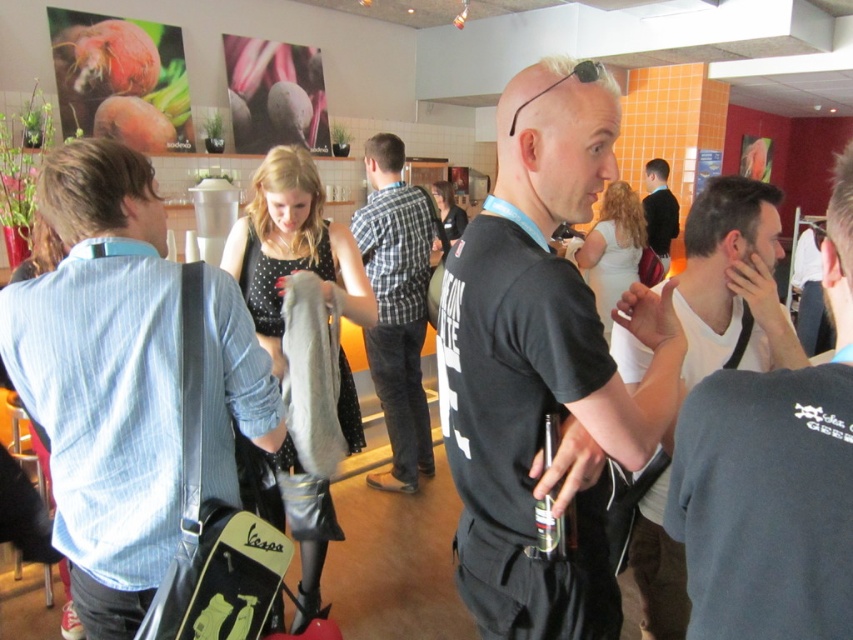
Is white matte tank top at right wider than plaid fabric shirt at center?

Correct, the width of white matte tank top at right exceeds that of plaid fabric shirt at center.

Is point (729, 360) behind point (358, 225)?

No.

The image size is (853, 640). Identify the location of white matte tank top at right. (733, 282).

From the picture: Who is lower down, plaid fabric shirt at center or dark blue shirt at center?

Positioned lower is plaid fabric shirt at center.

Does point (387, 232) come behind point (662, 221)?

No, (387, 232) is in front of (662, 221).

Identify the location of plaid fabric shirt at center. This screenshot has height=640, width=853. (397, 305).

Which is more to the left, black matte t-shirt at center or plaid fabric shirt at center?

plaid fabric shirt at center

Does point (509, 218) lie behind point (424, 401)?

No.

Is point (514, 282) closer to viewer compared to point (405, 285)?

Yes, it is in front of point (405, 285).

You are a GUI agent. You are given a task and a screenshot of the screen. Output one action in this format:
    pyautogui.click(x=<x>, y=<y>)
    Task: Click on the black matte t-shirt at center
    This screenshot has width=853, height=640.
    Given the screenshot: What is the action you would take?
    pyautogui.click(x=543, y=362)